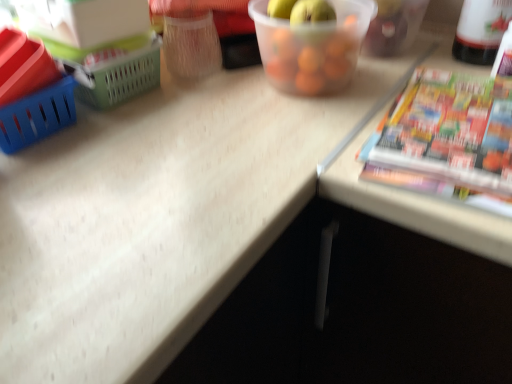
Question: From the image's perspective, is white plastic bottle at upper right located above or below multicolored glossy paperback book at right?

Choices:
 (A) above
 (B) below

Answer: (A)

Question: Is white plastic bottle at upper right wider or thinner than multicolored glossy paperback book at right?

Choices:
 (A) wide
 (B) thin

Answer: (B)

Question: Which object is the closest to the translucent plastic container at upper center?

Choices:
 (A) white plastic bottle at upper right
 (B) multicolored glossy paperback book at right

Answer: (B)

Question: Which is nearer to the white plastic bottle at upper right?

Choices:
 (A) translucent plastic container at upper center
 (B) multicolored glossy paperback book at right

Answer: (B)